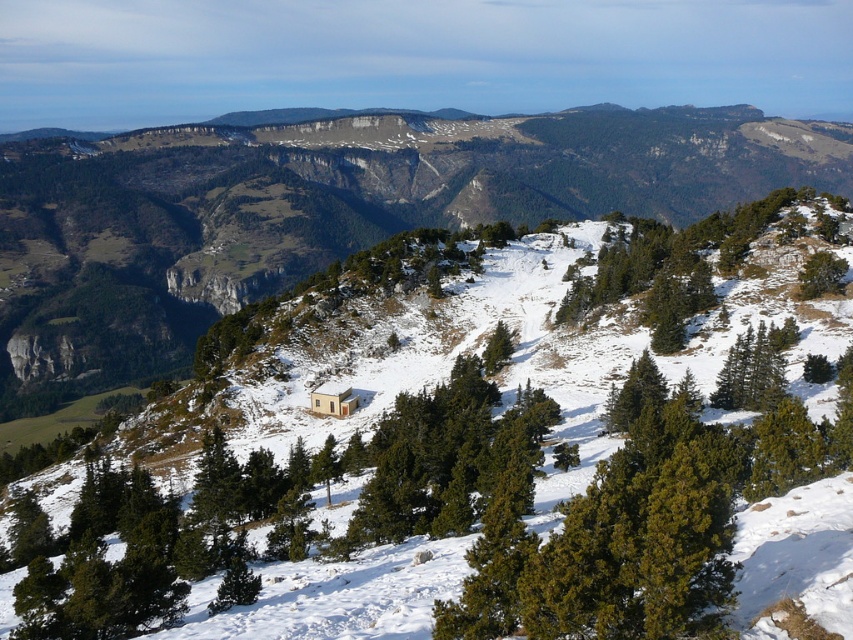
Question: Considering the relative positions of green matte tree at center and light brown wooden hut at center in the image provided, where is green matte tree at center located with respect to light brown wooden hut at center?

Choices:
 (A) right
 (B) left

Answer: (A)

Question: Does green matte tree at center have a smaller size compared to light brown wooden hut at center?

Choices:
 (A) no
 (B) yes

Answer: (A)

Question: Does green matte tree at center come in front of light brown wooden hut at center?

Choices:
 (A) yes
 (B) no

Answer: (A)

Question: Among these objects, which one is nearest to the camera?

Choices:
 (A) green matte tree at center
 (B) light brown wooden hut at center

Answer: (A)